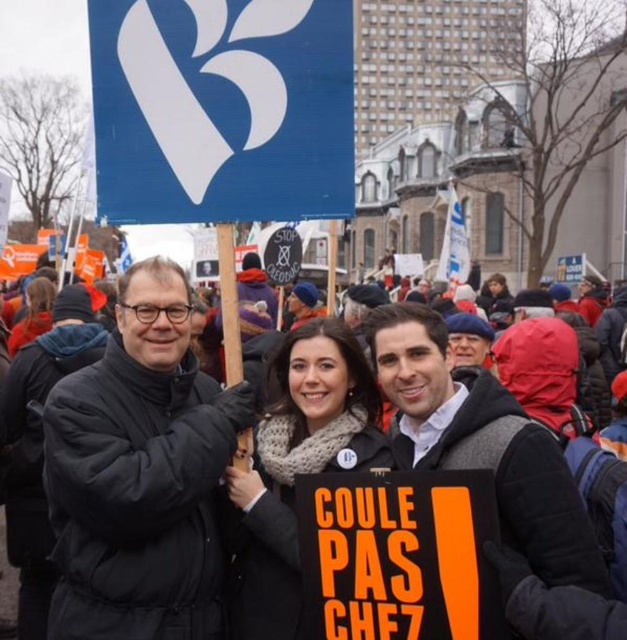
Question: Does black woolen scarf at center appear over knitted scarf at center?

Choices:
 (A) yes
 (B) no

Answer: (A)

Question: Which point is closer to the camera?

Choices:
 (A) orange paper placard at center
 (B) blue painted wood sign at upper center

Answer: (A)

Question: Which point is farther to the camera?

Choices:
 (A) black woolen scarf at center
 (B) knitted scarf at center
 (C) orange knit scarf at upper left
 (D) blue painted wood sign at upper center

Answer: (C)

Question: Which object is closer to the camera taking this photo?

Choices:
 (A) orange paper placard at center
 (B) blue painted wood sign at upper center
 (C) black woolen scarf at center

Answer: (A)

Question: In this image, where is blue painted wood sign at upper center located relative to knitted scarf at center?

Choices:
 (A) below
 (B) above

Answer: (B)

Question: Does blue painted wood sign at upper center have a larger size compared to orange paper placard at center?

Choices:
 (A) no
 (B) yes

Answer: (B)